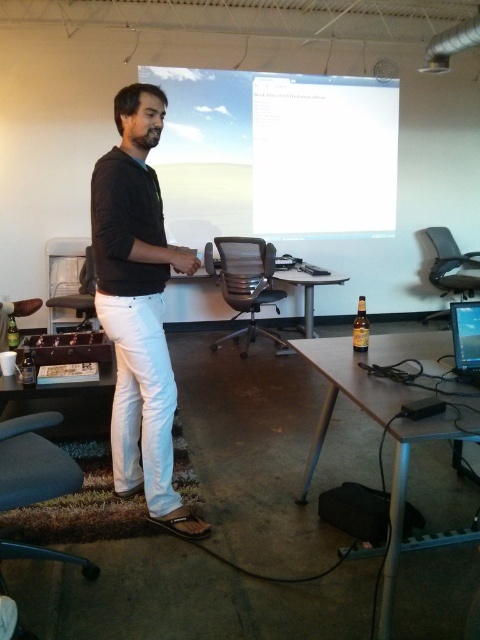
Question: Which object is the farthest from the metallic silver table at lower right?

Choices:
 (A) matte black swivel chair at center
 (B) white glossy projection screen at upper center

Answer: (B)

Question: Is metallic silver table at lower right smaller than matte black monitor at center?

Choices:
 (A) no
 (B) yes

Answer: (A)

Question: Which point is farther to the camera?

Choices:
 (A) brown wood table at center
 (B) black matte shirt at center

Answer: (A)

Question: Can you confirm if black matte shirt at center is bigger than brown wood table at lower left?

Choices:
 (A) yes
 (B) no

Answer: (A)

Question: Can you confirm if metallic silver table at lower right is positioned to the left of matte black monitor at center?

Choices:
 (A) no
 (B) yes

Answer: (B)

Question: Which object appears closest to the camera in this image?

Choices:
 (A) matte black monitor at center
 (B) brown wood table at center

Answer: (A)